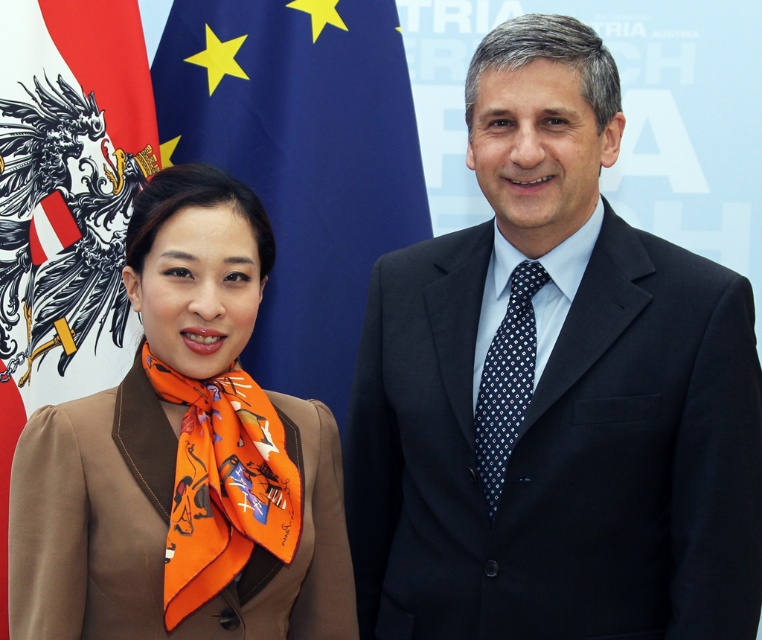
Question: Which point is farther from the camera taking this photo?

Choices:
 (A) (504, 314)
 (B) (261, 474)

Answer: (A)

Question: Is dark blue suit at center further to the viewer compared to brown silk scarf at left?

Choices:
 (A) no
 (B) yes

Answer: (B)

Question: Based on their relative distances, which object is nearer to the blue fabric flag at upper center?

Choices:
 (A) dark blue silk tie at center
 (B) dark blue suit at center
 (C) brown silk scarf at left

Answer: (B)

Question: Estimate the real-world distances between objects in this image. Which object is farther from the dark blue suit at center?

Choices:
 (A) blue fabric flag at upper center
 (B) brown silk scarf at left

Answer: (A)

Question: Can you confirm if dark blue suit at center is positioned below blue fabric flag at upper center?

Choices:
 (A) no
 (B) yes

Answer: (B)

Question: Is dark blue suit at center wider than brown silk scarf at left?

Choices:
 (A) yes
 (B) no

Answer: (A)